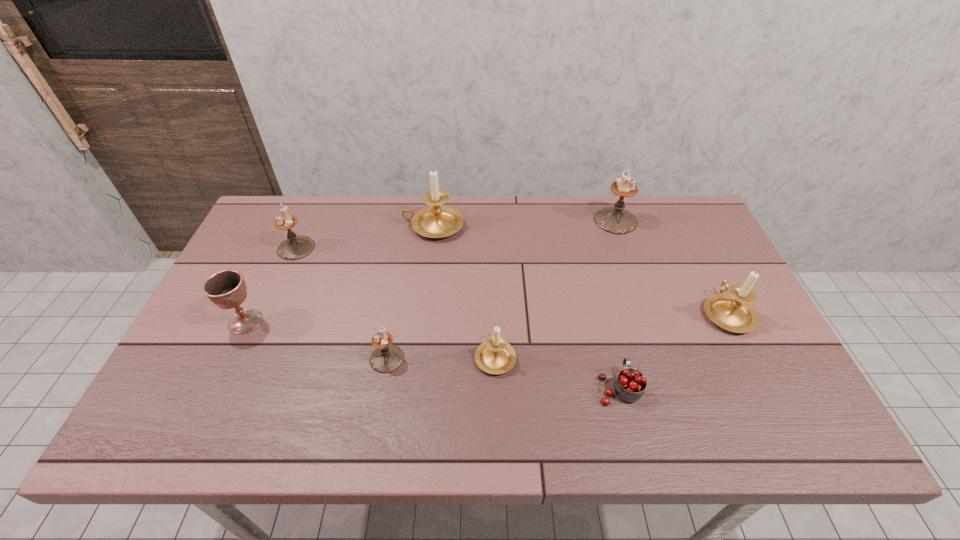
Identify the location of vacant space located with a handle on the side of the rightmost candle holder. (676, 212).

Locate an element on the screen. The width and height of the screenshot is (960, 540). vacant space situated with a handle on the side of the rightmost candle holder is located at coordinates (692, 243).

You are a GUI agent. You are given a task and a screenshot of the screen. Output one action in this format:
    pyautogui.click(x=<x>, y=<y>)
    Task: Click on the vacant space positioned with a handle on the side of the rightmost candle holder
    This screenshot has width=960, height=540.
    Given the screenshot: What is the action you would take?
    pyautogui.click(x=689, y=237)

Image resolution: width=960 pixels, height=540 pixels. Find the location of `vacant point located on the back of the chalice`. vacant point located on the back of the chalice is located at coordinates (290, 226).

This screenshot has height=540, width=960. What are the coordinates of `free space located 0.250m with a handle on the side of the fifth object from left to right` in the screenshot? It's located at [x=492, y=267].

You are a GUI agent. You are given a task and a screenshot of the screen. Output one action in this format:
    pyautogui.click(x=<x>, y=<y>)
    Task: Click on the free space located 0.200m with a handle on the side of the fifth object from left to right
    This screenshot has width=960, height=540.
    Given the screenshot: What is the action you would take?
    [493, 280]

At what (x,y) coordinates should I click in order to perform the action: click on free spot located 0.290m with a handle on the side of the fifth object from left to right. Please return your answer as a coordinate pair (x, y). This screenshot has height=540, width=960. Looking at the image, I should click on [x=492, y=258].

Identify the location of blank space located on the left of the second purple candle holder from left to right. The width and height of the screenshot is (960, 540). (243, 359).

Identify the location of vacant space situated on the handle side of the red cherry. (606, 333).

Find the location of a particular element. The height and width of the screenshot is (540, 960). vacant space situated 0.060m on the handle side of the red cherry is located at coordinates (610, 349).